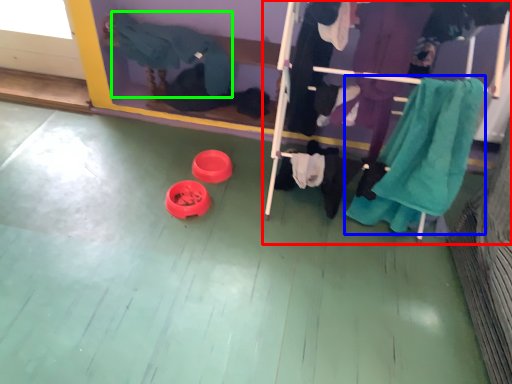
Question: Which is farther away from furniture (highlighted by a red box)? clothing (highlighted by a blue box) or clothing (highlighted by a green box)?

Choices:
 (A) clothing
 (B) clothing

Answer: (B)